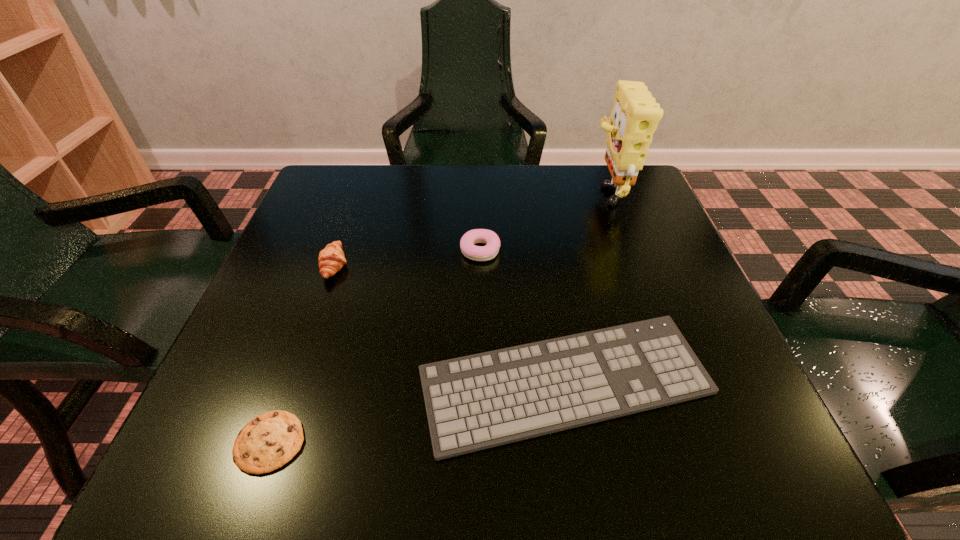
Locate an element on the screen. vacant space at the far right corner of the desktop is located at coordinates (651, 211).

Locate an element on the screen. This screenshot has height=540, width=960. unoccupied area between the left pastry and the shortest object is located at coordinates (302, 354).

Locate an element on the screen. The height and width of the screenshot is (540, 960). free space between the farthest object and the shortest object is located at coordinates (438, 316).

In order to click on unoccupied position between the taller pastry and the fourth tallest object in this screenshot , I will do `click(450, 324)`.

Image resolution: width=960 pixels, height=540 pixels. I want to click on free spot between the tallest object and the third tallest object, so click(x=542, y=221).

Where is `free space between the shortest object and the left pastry`? Image resolution: width=960 pixels, height=540 pixels. free space between the shortest object and the left pastry is located at coordinates (302, 354).

Find the location of a particular element. The image size is (960, 540). free space between the fourth tallest object and the sponge is located at coordinates (586, 287).

Identify the location of vacant space in between the fourth tallest object and the cookie. This screenshot has height=540, width=960. (418, 413).

The width and height of the screenshot is (960, 540). I want to click on empty space that is in between the taller pastry and the third tallest object, so click(407, 258).

The height and width of the screenshot is (540, 960). What are the coordinates of `vacant area that lies between the taller pastry and the fourth tallest object` in the screenshot? It's located at (450, 324).